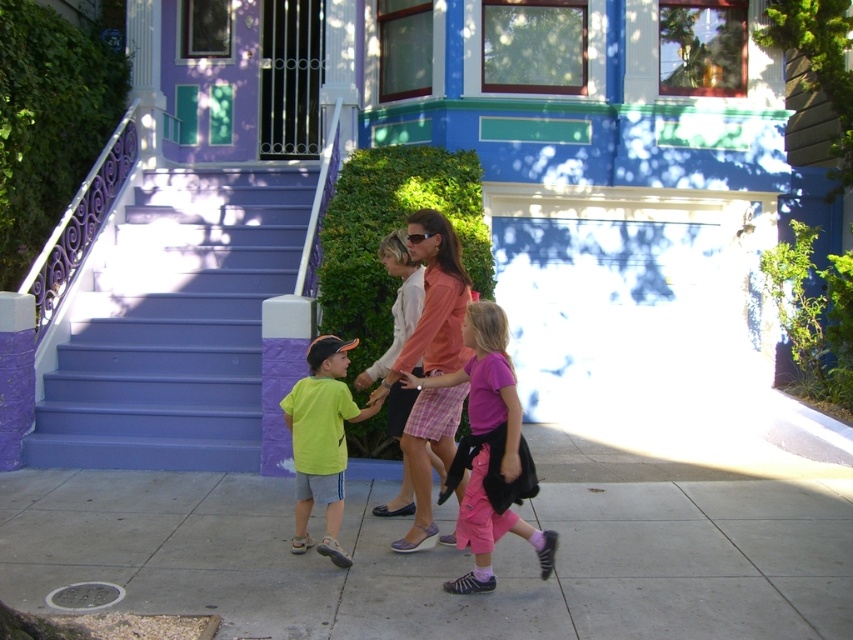
Question: Is purple painted stairs at left below pink fabric skirt at center?

Choices:
 (A) yes
 (B) no

Answer: (B)

Question: Is gray concrete sidewalk at lower center thinner than purple painted stairs at left?

Choices:
 (A) yes
 (B) no

Answer: (B)

Question: Where is pink fabric skirt at center located in relation to neon yellow t-shirt at center in the image?

Choices:
 (A) right
 (B) left

Answer: (A)

Question: Which object is farther from the camera taking this photo?

Choices:
 (A) pink fabric skirt at center
 (B) purple painted stairs at left
 (C) gray concrete sidewalk at lower center
 (D) neon yellow t-shirt at center

Answer: (B)

Question: Which object is positioned closest to the pink cotton pants at center?

Choices:
 (A) gray concrete sidewalk at lower center
 (B) purple painted stairs at left
 (C) neon yellow t-shirt at center
 (D) pink fabric skirt at center

Answer: (D)

Question: Which of these objects is positioned farthest from the pink fabric skirt at center?

Choices:
 (A) neon yellow t-shirt at center
 (B) purple painted stairs at left
 (C) pink cotton pants at center

Answer: (B)